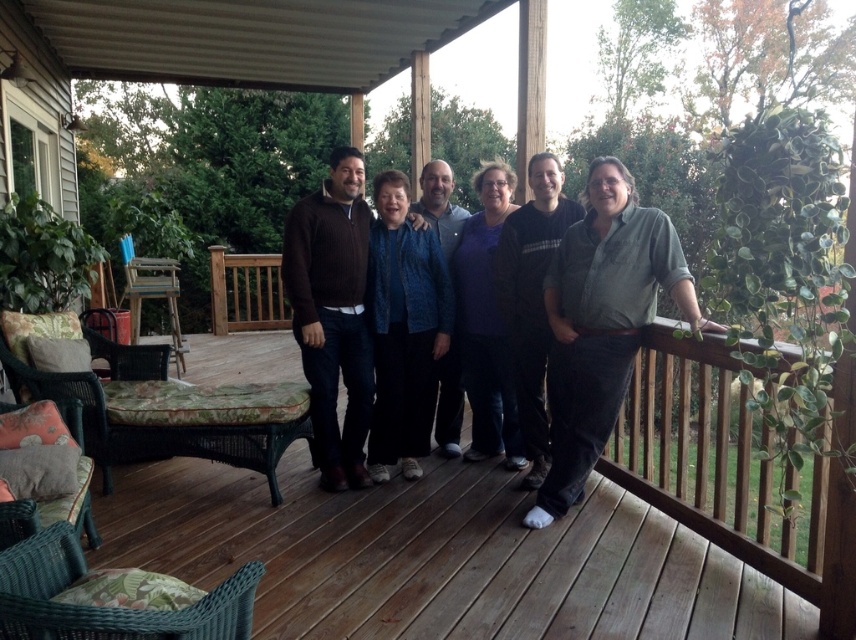
Question: Estimate the real-world distances between objects in this image. Which object is closer to the blue denim jeans at center?

Choices:
 (A) black cotton shirt at center
 (B) green cotton shirt at right

Answer: (B)

Question: Considering the real-world distances, which object is farthest from the wooden deck at center?

Choices:
 (A) green cotton shirt at right
 (B) brown sweater at center
 (C) black cotton shirt at center
 (D) blue textured sweater at center

Answer: (D)

Question: Where is green cotton shirt at right located in relation to blue textured sweater at center in the image?

Choices:
 (A) right
 (B) left

Answer: (A)

Question: Does wooden deck at center have a smaller size compared to green cotton shirt at right?

Choices:
 (A) no
 (B) yes

Answer: (A)

Question: Among these points, which one is nearest to the camera?

Choices:
 (A) pyautogui.click(x=628, y=193)
 (B) pyautogui.click(x=607, y=620)
 (C) pyautogui.click(x=360, y=465)
 (D) pyautogui.click(x=462, y=212)

Answer: (B)

Question: Is blue denim jeans at center smaller than black cotton shirt at center?

Choices:
 (A) yes
 (B) no

Answer: (B)